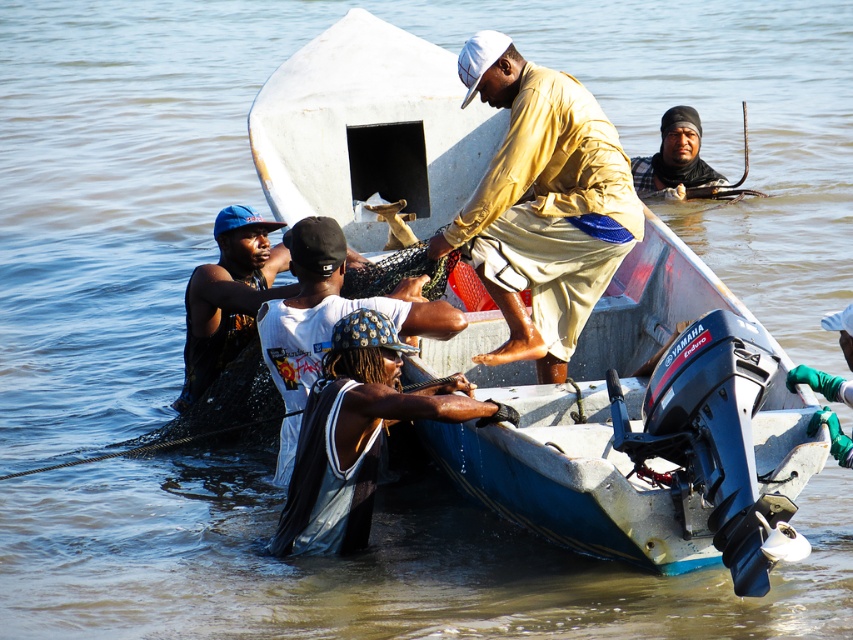
Question: Which point appears farthest from the camera in this image?

Choices:
 (A) tap(526, 326)
 (B) tap(664, 157)

Answer: (B)

Question: Which point is closer to the camera?

Choices:
 (A) dark brown leather jacket at upper center
 (B) dark blue fabric at center
 (C) matte yellow shirt at center

Answer: (B)

Question: Which of the following is the closest to the observer?

Choices:
 (A) (616, 240)
 (B) (285, 460)

Answer: (B)

Question: Can you confirm if matte yellow shirt at center is wider than white matte shirt at center?

Choices:
 (A) yes
 (B) no

Answer: (A)

Question: Can you confirm if matte yellow shirt at center is thinner than dark blue fabric at center?

Choices:
 (A) no
 (B) yes

Answer: (A)

Question: Observing the image, what is the correct spatial positioning of white matte shirt at center in reference to dark brown leather jacket at upper center?

Choices:
 (A) right
 (B) left

Answer: (B)